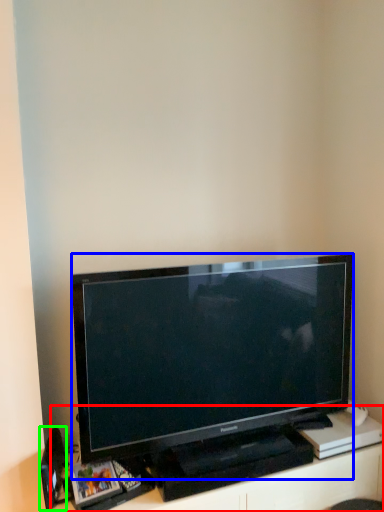
Question: Which object is positioned closest to entertainment center (highlighted by a red box)? Select from television (highlighted by a blue box) and speaker (highlighted by a green box).

Choices:
 (A) television
 (B) speaker

Answer: (A)